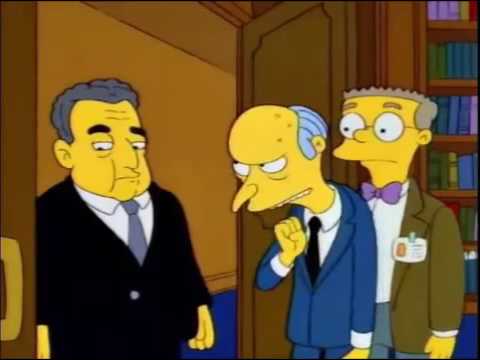
This screenshot has height=360, width=480. I want to click on blue carpet, so click(x=228, y=315).